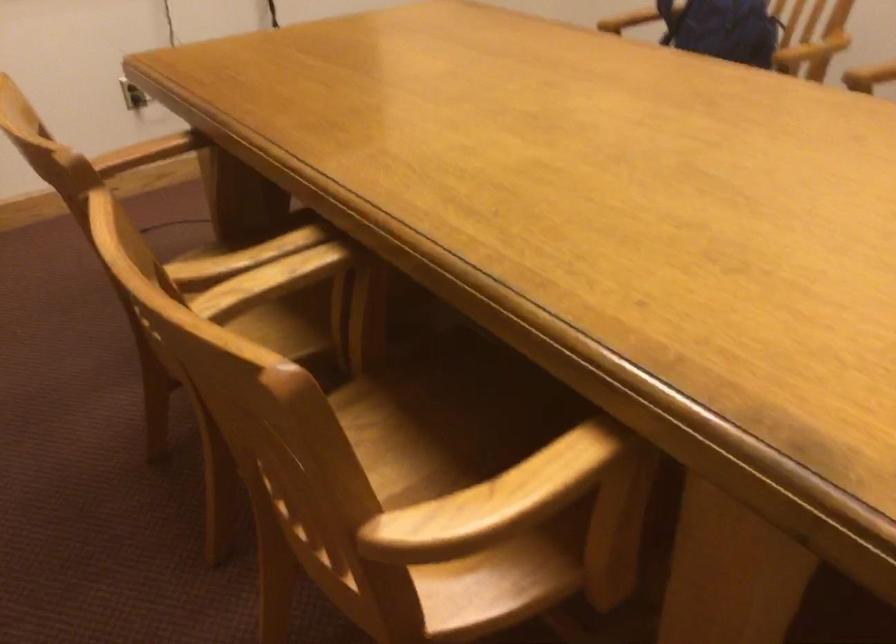
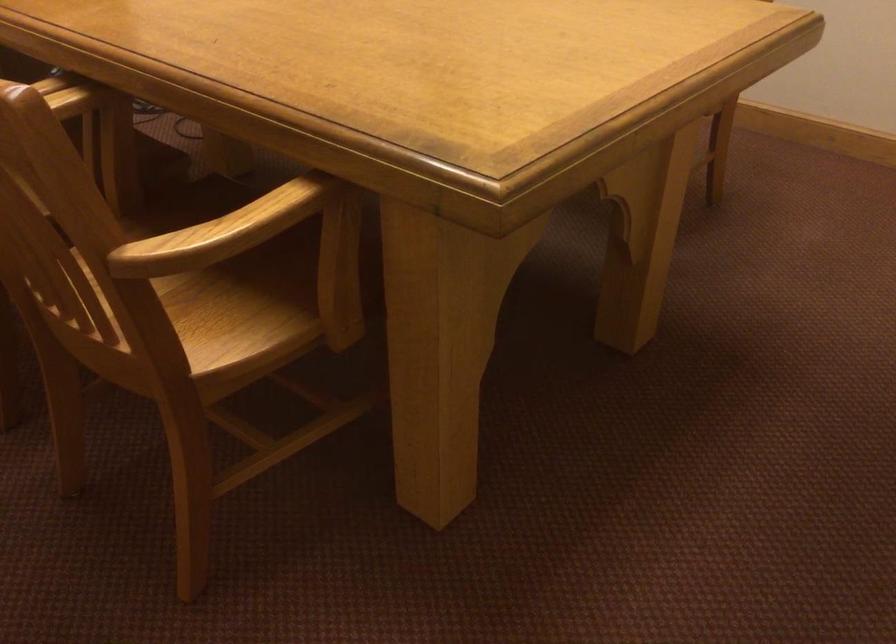
Where in the second image is the point corresponding to pixel 497 518 from the first image?

(221, 232)